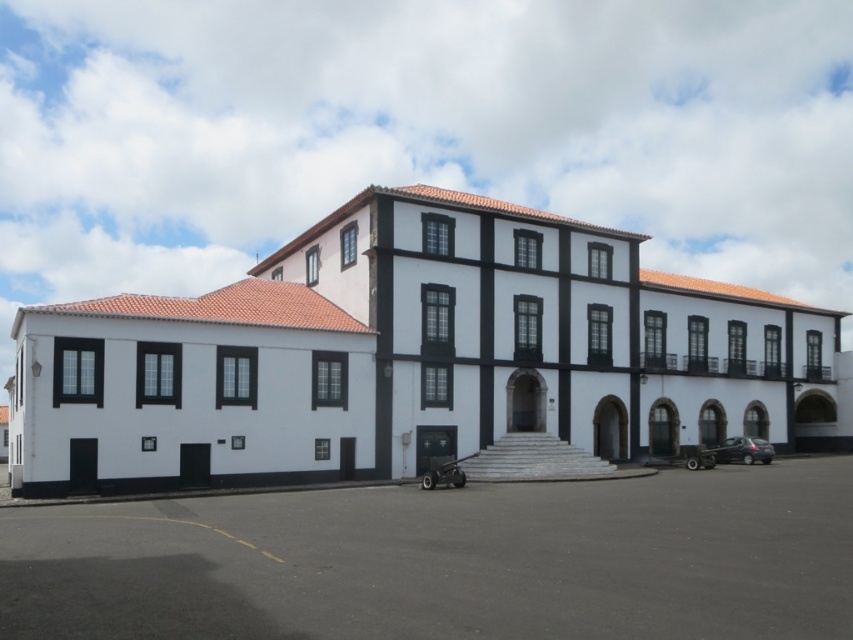
Question: Does black matte trim at center have a larger size compared to dark asphalt parking lot at center?

Choices:
 (A) yes
 (B) no

Answer: (A)

Question: Does black matte trim at center have a lesser width compared to dark asphalt parking lot at center?

Choices:
 (A) no
 (B) yes

Answer: (A)

Question: Can you confirm if black matte trim at center is smaller than dark asphalt parking lot at center?

Choices:
 (A) yes
 (B) no

Answer: (B)

Question: Which point is closer to the camera?

Choices:
 (A) black matte trim at center
 (B) dark asphalt parking lot at center

Answer: (B)

Question: Which point is farther to the camera?

Choices:
 (A) (700, 611)
 (B) (567, 390)

Answer: (B)